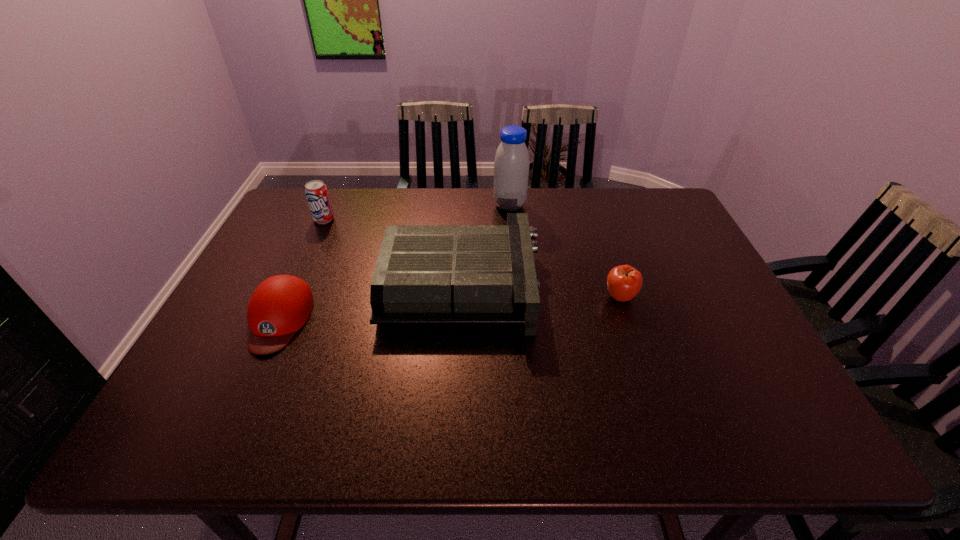
Locate an element on the screen. soya milk is located at coordinates click(x=511, y=165).

Where is `soda can`? The image size is (960, 540). soda can is located at coordinates (316, 192).

Where is `radio receiver`? radio receiver is located at coordinates (425, 274).

This screenshot has width=960, height=540. In order to click on apple in this screenshot , I will do (624, 282).

Locate an element on the screen. The height and width of the screenshot is (540, 960). baseball cap is located at coordinates (280, 305).

The width and height of the screenshot is (960, 540). I want to click on free space located 0.150m on the front of the soya milk, so click(513, 243).

Image resolution: width=960 pixels, height=540 pixels. Identify the location of vacant region located on the front of the soda can. (281, 312).

Where is `free spot located on the front panel of the radio receiver`? The image size is (960, 540). free spot located on the front panel of the radio receiver is located at coordinates (643, 285).

Where is `vacant space situated on the left of the apple`? The width and height of the screenshot is (960, 540). vacant space situated on the left of the apple is located at coordinates (564, 297).

Identify the location of free space located on the front-facing side of the baseball cap. (249, 388).